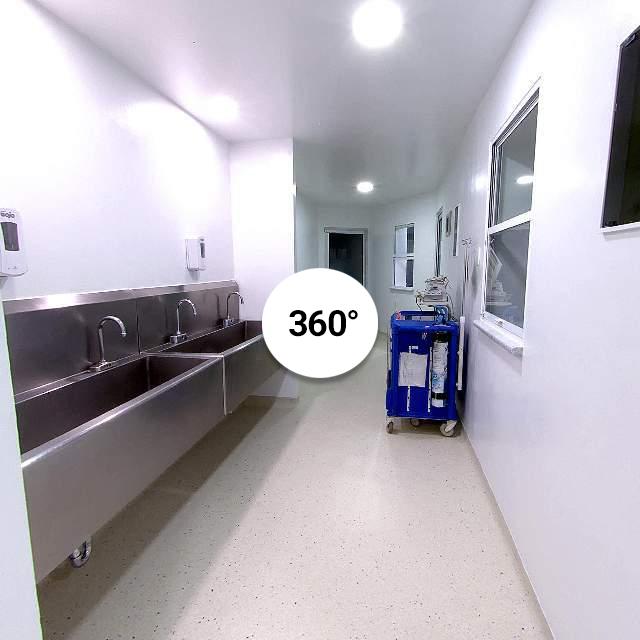
At what (x,y) coordinates should I click in order to perform the action: click on custodial cart. Please return your answer as a coordinate pair (x, y). Image resolution: width=640 pixels, height=640 pixels. Looking at the image, I should click on (418, 336).